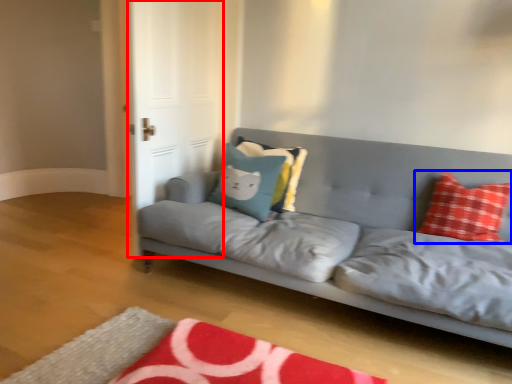
Question: Which object is closer to the camera taking this photo, glass door (highlighted by a red box) or pillow (highlighted by a blue box)?

Choices:
 (A) glass door
 (B) pillow

Answer: (B)